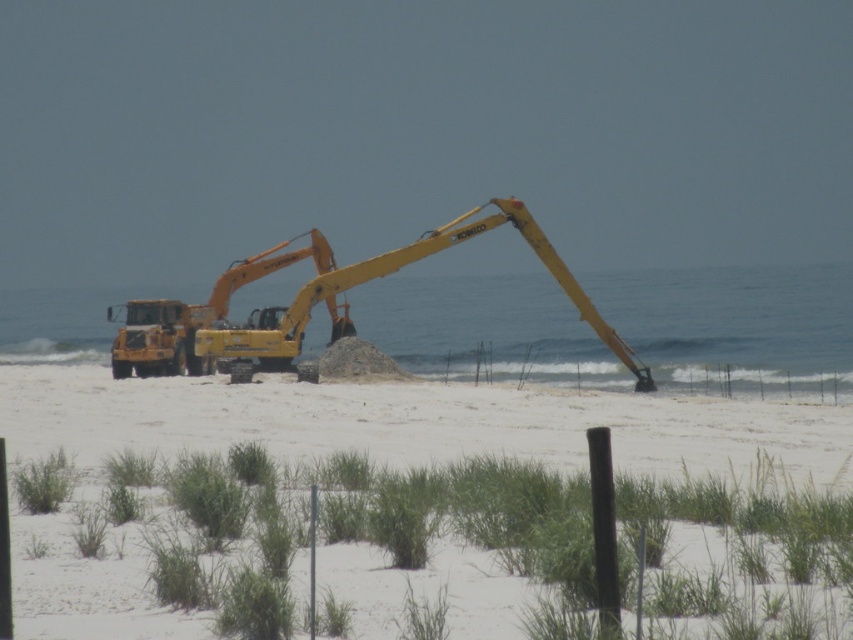
Question: Can you confirm if white sand beach at center is positioned above yellow metallic excavator at center?

Choices:
 (A) no
 (B) yes

Answer: (A)

Question: Is white sand beach at center positioned at the back of yellow metallic excavator at center?

Choices:
 (A) no
 (B) yes

Answer: (A)

Question: Which of the following is the farthest from the observer?

Choices:
 (A) (355, 282)
 (B) (560, 467)

Answer: (A)

Question: Which object is farther from the camera taking this photo?

Choices:
 (A) white sand beach at center
 (B) yellow metallic excavator at center

Answer: (B)

Question: Can you confirm if white sand beach at center is positioned to the left of yellow metallic excavator at center?

Choices:
 (A) no
 (B) yes

Answer: (A)